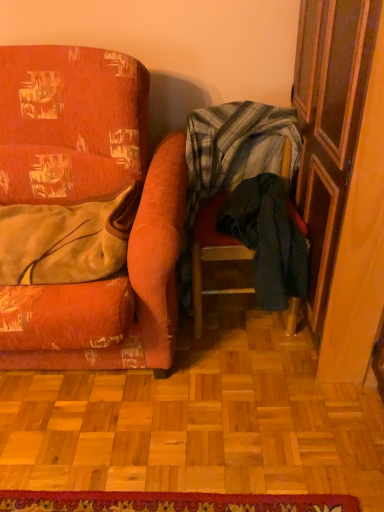
Question: In terms of width, does distressed orange fabric chair at left, the first chair viewed from the left, look wider or thinner when compared to wooden screen door at right?

Choices:
 (A) wide
 (B) thin

Answer: (A)

Question: Is point (140, 324) positioned closer to the camera than point (360, 123)?

Choices:
 (A) farther
 (B) closer

Answer: (A)

Question: Which object is positioned closest to the wooden screen door at right?

Choices:
 (A) dark green fabric at lower right, the 2th clothing when ordered from left to right
 (B) red woven mat at lower center
 (C) velvet-like beige blanket at left, the second clothing positioned from the right
 (D) plaid fabric chair at center, the second chair from the left
 (E) distressed orange fabric chair at left, the first chair viewed from the left

Answer: (A)

Question: Which of these objects is positioned closest to the dark green fabric at lower right, positioned as the 1th clothing in right-to-left order?

Choices:
 (A) plaid fabric chair at center, acting as the 1th chair starting from the right
 (B) wooden screen door at right
 (C) distressed orange fabric chair at left, the first chair viewed from the left
 (D) red woven mat at lower center
 (E) velvet-like beige blanket at left, which appears as the first clothing when viewed from the left

Answer: (A)